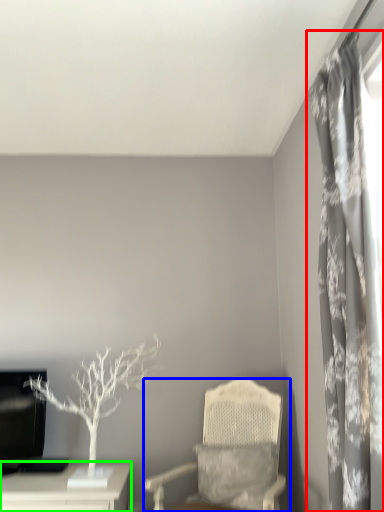
Question: Which object is the farthest from curtain (highlighted by a red box)? Choose among these: chair (highlighted by a blue box) or table (highlighted by a green box).

Choices:
 (A) chair
 (B) table

Answer: (B)